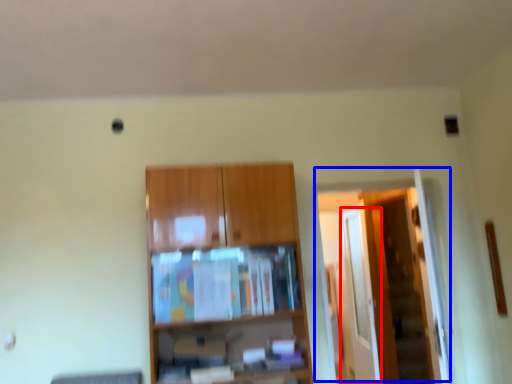
Question: Which of the following is the farthest to the observer, glass door (highlighted by a red box) or door (highlighted by a blue box)?

Choices:
 (A) glass door
 (B) door

Answer: (A)